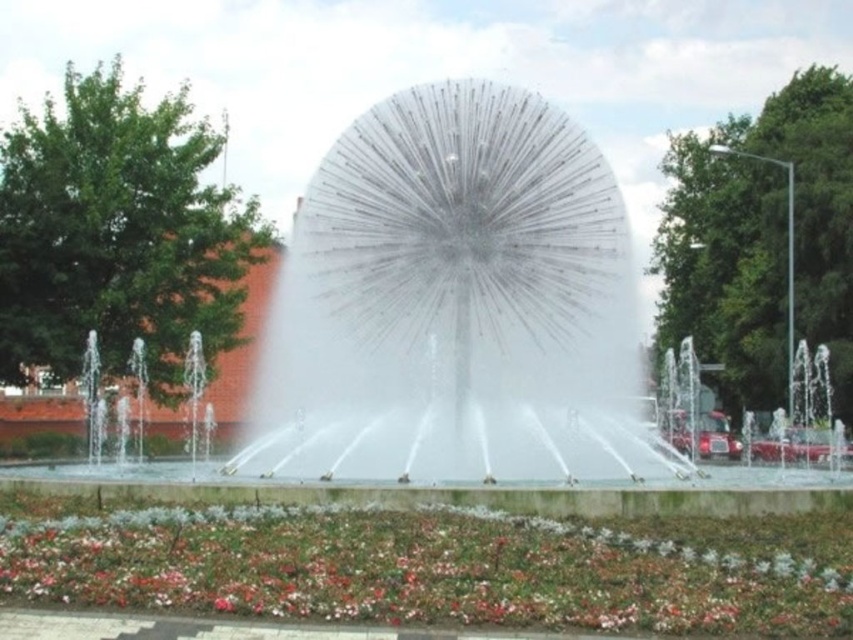
You are a maintenance worker needing to reach both the transparent glass sphere at center and the multicolored fabric flower at lower center. Given that your ladder is 8 meters long, can you safely reach both objects without moving the ladder?

The transparent glass sphere at center and multicolored fabric flower at lower center are 7.98 meters apart. Since the ladder is 8 meters long, it can be positioned between them to reach both objects safely.

You are a photographer planning to take a photo of the transparent glass sphere at center and the multicolored fabric flower at lower center. Which object should you focus on first if you want to ensure both are in focus, considering their heights?

The transparent glass sphere at center is taller than the multicolored fabric flower at lower center, so you should focus on the transparent glass sphere at center first to ensure both are in focus.

You are a photographer planning to capture the fountain and the flower bed. You want to ensure that both the transparent glass sphere at center and the multicolored fabric flower at lower center are clearly visible in your shot. Given their sizes, which object should you focus on first to ensure proper framing?

The transparent glass sphere at center is wider than the multicolored fabric flower at lower center. To ensure proper framing, focus on the transparent glass sphere at center first as it requires more space in the frame due to its larger width.